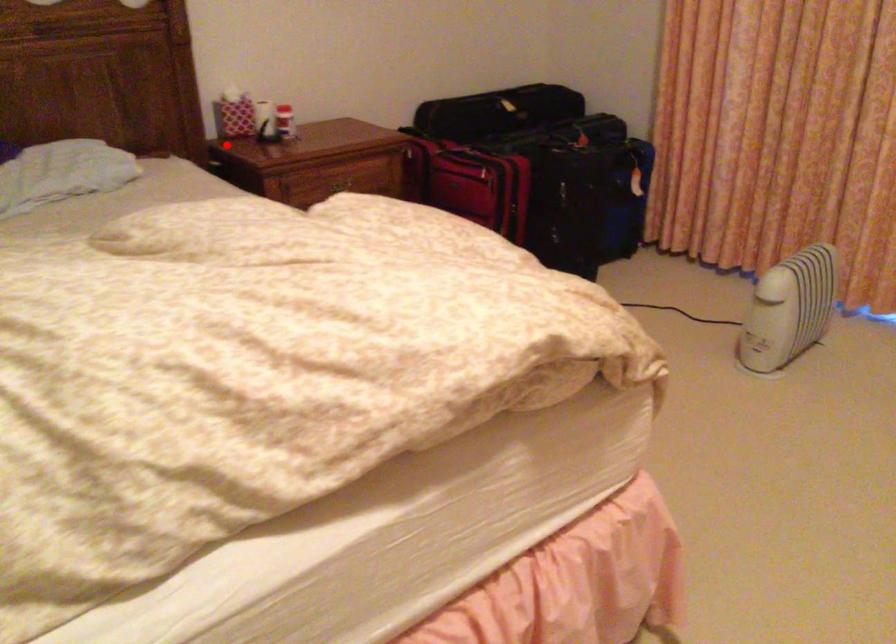
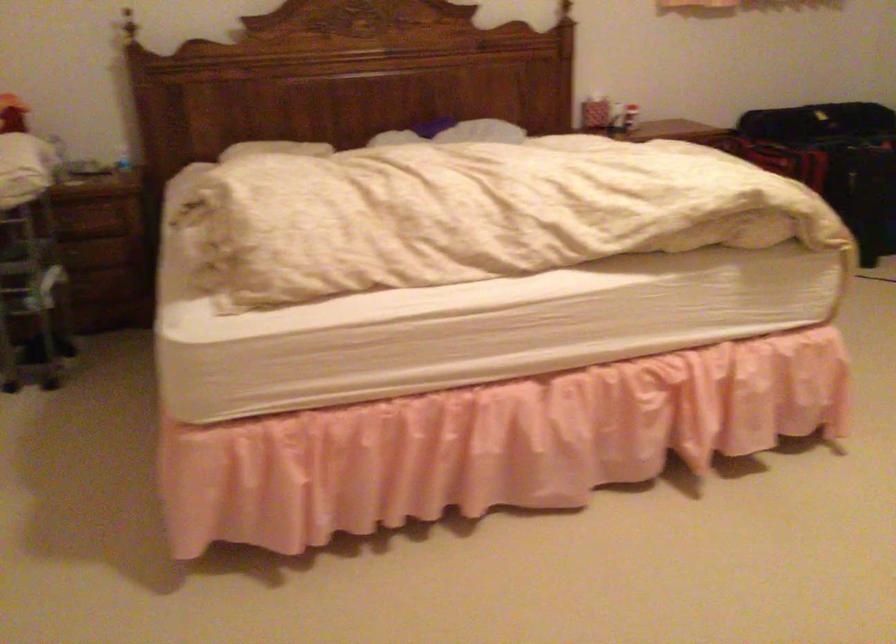
In the second image, find the point that corresponds to the highlighted location in the first image.

(590, 109)